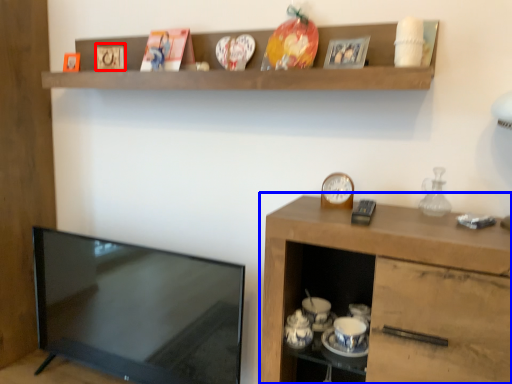
Question: Among these objects, which one is farthest to the camera, picture frame (highlighted by a red box) or cabinetry (highlighted by a blue box)?

Choices:
 (A) picture frame
 (B) cabinetry

Answer: (A)